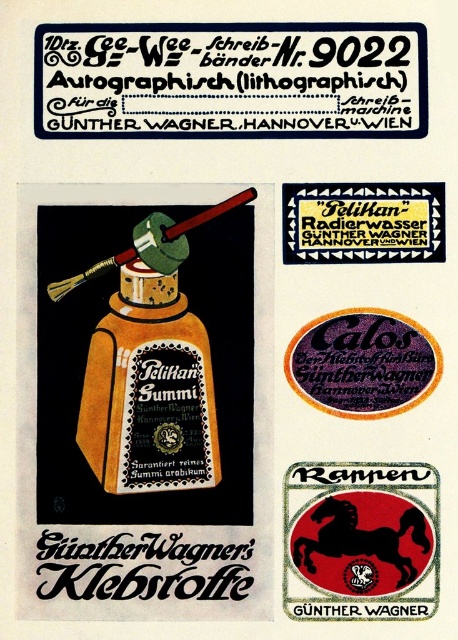
Question: Can you confirm if matte gold bottle at center is wider than black rubber horse at lower right?

Choices:
 (A) no
 (B) yes

Answer: (A)

Question: Which object appears farthest from the camera in this image?

Choices:
 (A) black paper sticker at upper center
 (B) matte gold bottle at center
 (C) black rubber horse at lower right

Answer: (A)

Question: Is matte gold bottle at center wider than black paper sticker at upper center?

Choices:
 (A) no
 (B) yes

Answer: (A)

Question: Which object is the closest to the black rubber horse at lower right?

Choices:
 (A) matte gold bottle at center
 (B) black paper sticker at upper center

Answer: (A)

Question: Estimate the real-world distances between objects in this image. Which object is closer to the matte gold bottle at center?

Choices:
 (A) black rubber horse at lower right
 (B) black paper sticker at upper center

Answer: (A)

Question: Can you confirm if black rubber horse at lower right is positioned to the right of black paper sticker at upper center?

Choices:
 (A) no
 (B) yes

Answer: (A)